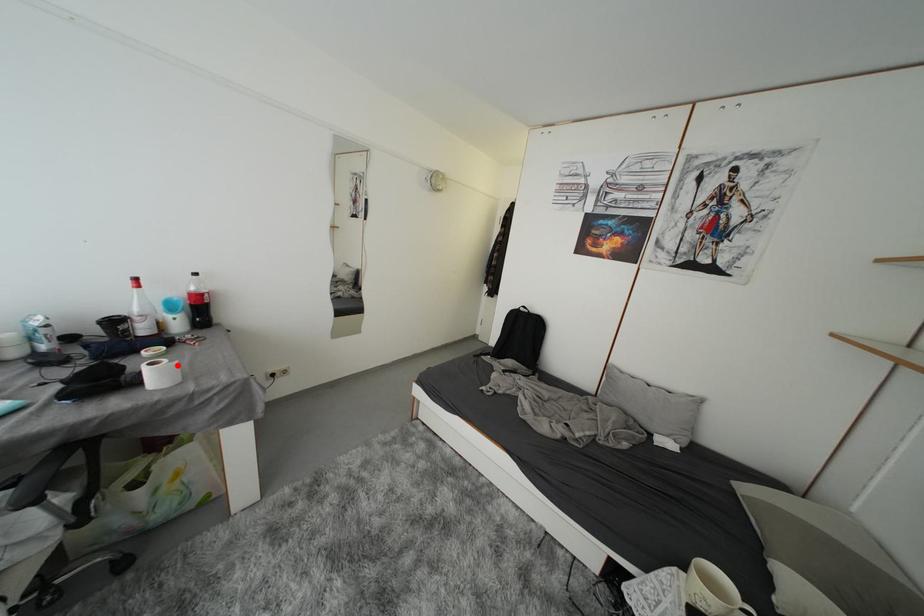
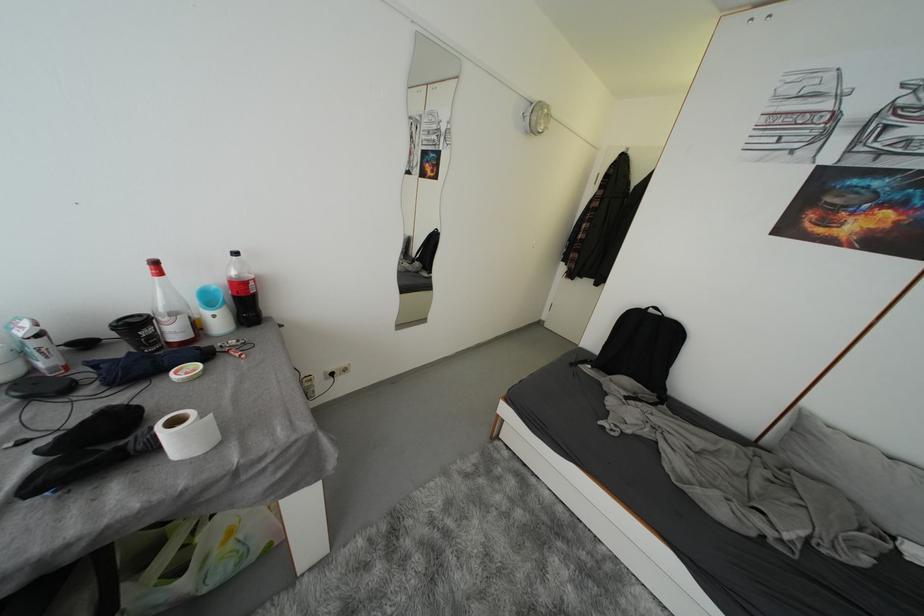
In the second image, find the point that corresponds to the highlighted location in the first image.

(208, 419)